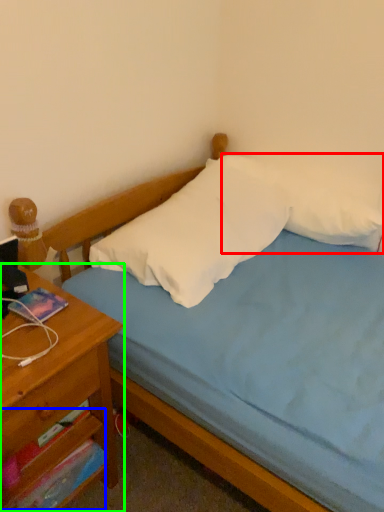
Question: Which is nearer to the pillow (highlighted by a red box)? drawer (highlighted by a blue box) or nightstand (highlighted by a green box).

Choices:
 (A) drawer
 (B) nightstand

Answer: (B)